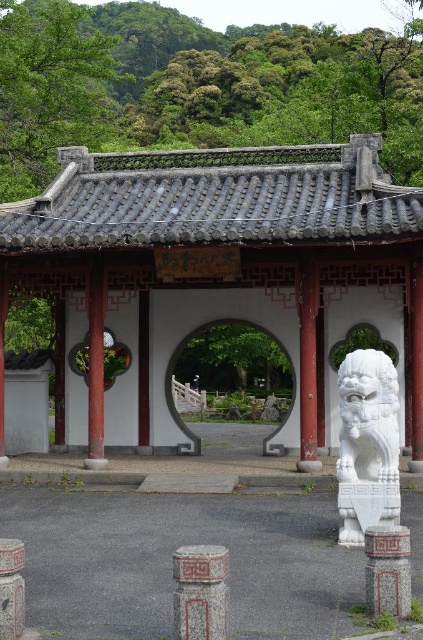
Question: Which point appears closest to the camera in this image?

Choices:
 (A) (178, 568)
 (B) (404, 561)
 (C) (360, 310)

Answer: (A)

Question: Does white stone gazebo at center appear under white stone archway at center?

Choices:
 (A) no
 (B) yes

Answer: (A)

Question: Which object appears farthest from the camera in this image?

Choices:
 (A) white stone pillar at right
 (B) white marble lion at right
 (C) white stone gazebo at center
 (D) smooth gray stone pillar at lower left

Answer: (C)

Question: Which object is the farthest from the white stone archway at center?

Choices:
 (A) white stone pillar at right
 (B) white stone gazebo at center
 (C) smooth gray stone pillar at lower left
 (D) white marble lion at right

Answer: (C)

Question: Observing the image, what is the correct spatial positioning of white stone gazebo at center in reference to white marble lion at right?

Choices:
 (A) right
 (B) left

Answer: (B)

Question: Can you confirm if white marble lion at right is positioned to the left of carved stone pillar at center?

Choices:
 (A) no
 (B) yes

Answer: (A)